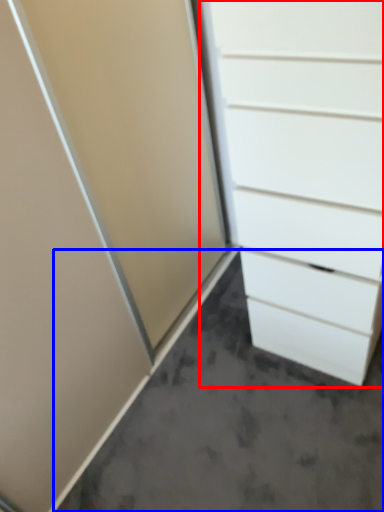
Question: Which of the following is the farthest to the observer, chest of drawers (highlighted by a red box) or concrete (highlighted by a blue box)?

Choices:
 (A) chest of drawers
 (B) concrete

Answer: (B)